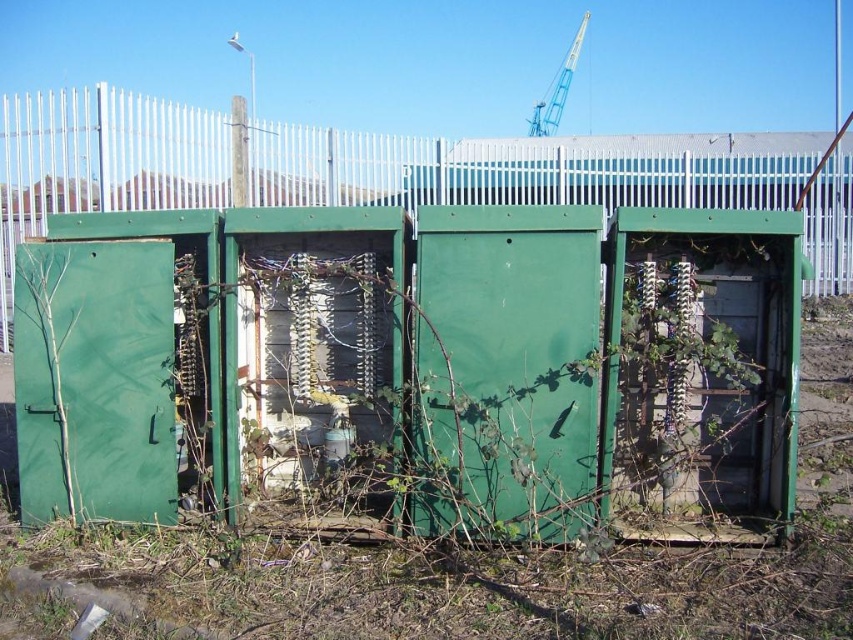
Question: Can you confirm if green painted metal fence at center is positioned above yellow metallic crane at upper center?

Choices:
 (A) yes
 (B) no

Answer: (B)

Question: Can you confirm if green painted metal fence at center is wider than yellow metallic crane at upper center?

Choices:
 (A) no
 (B) yes

Answer: (B)

Question: Among these points, which one is nearest to the camera?

Choices:
 (A) (566, 61)
 (B) (35, 198)

Answer: (B)

Question: Which point is farther to the camera?

Choices:
 (A) yellow metallic crane at upper center
 (B) green painted metal fence at center

Answer: (A)

Question: From the image, what is the correct spatial relationship of green painted metal fence at center in relation to yellow metallic crane at upper center?

Choices:
 (A) below
 (B) above

Answer: (A)

Question: Among these objects, which one is farthest from the camera?

Choices:
 (A) yellow metallic crane at upper center
 (B) green painted metal fence at center

Answer: (A)